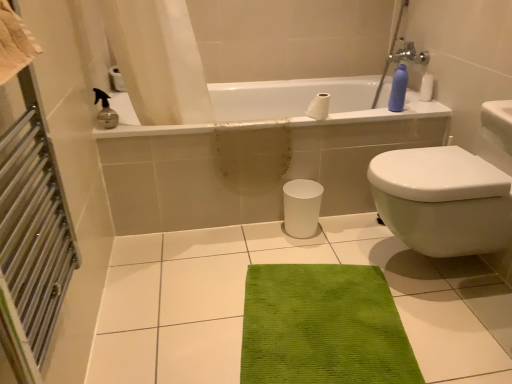
What do you see at coordinates (319, 107) in the screenshot? I see `white matte toilet paper at upper center` at bounding box center [319, 107].

This screenshot has height=384, width=512. In order to click on white matte toilet paper at upper center in this screenshot , I will do click(x=319, y=107).

What do you see at coordinates (259, 153) in the screenshot? Image resolution: width=512 pixels, height=384 pixels. I see `white glossy bathtub at upper center` at bounding box center [259, 153].

Describe the element at coordinates (301, 207) in the screenshot. This screenshot has width=512, height=384. I see `white glossy trash can at center` at that location.

Where is `white glossy bidet at right`? Image resolution: width=512 pixels, height=384 pixels. white glossy bidet at right is located at coordinates (442, 200).

Describe the element at coordinates (286, 263) in the screenshot. I see `white ceramic tile at center` at that location.

Find the location of `white matte toilet paper at upper center`. white matte toilet paper at upper center is located at coordinates (319, 107).

Is white glossy trash can at center outside of green textured mat at center?

Yes, white glossy trash can at center is located beyond the bounds of green textured mat at center.

Based on the photo, considering the relative positions of white glossy trash can at center and green textured mat at center in the image provided, is white glossy trash can at center behind green textured mat at center?

That is True.

Does white glossy trash can at center have a larger size compared to green textured mat at center?

Incorrect, white glossy trash can at center is not larger than green textured mat at center.

From the image's perspective, is matte blue plastic bottle at upper right above beige cotton towel at left?

Yes.

Which is in front, matte blue plastic bottle at upper right or beige cotton towel at left?

beige cotton towel at left is closer to the camera.

Would you say matte blue plastic bottle at upper right is a long distance from beige cotton towel at left?

Absolutely, matte blue plastic bottle at upper right is distant from beige cotton towel at left.

Is white matte toilet paper at upper center aimed at white glossy trash can at center?

No, white matte toilet paper at upper center is not turned towards white glossy trash can at center.

Considering the sizes of objects white matte toilet paper at upper center and white glossy trash can at center in the image provided, who is wider, white matte toilet paper at upper center or white glossy trash can at center?

white glossy trash can at center.

Considering the positions of objects white matte toilet paper at upper center and white glossy trash can at center in the image provided, who is behind, white matte toilet paper at upper center or white glossy trash can at center?

white glossy trash can at center is further away from the camera.

Is point (316, 114) positioned behind point (298, 206)?

No, it is not.

From a real-world perspective, is white glossy bidet at right below beige cotton towel at left?

Yes, from a real-world perspective, white glossy bidet at right is beneath beige cotton towel at left.

From the image's perspective, would you say white glossy bidet at right is shown under beige cotton towel at left?

Yes, from the image's perspective, white glossy bidet at right is below beige cotton towel at left.

Is white glossy bidet at right not near beige cotton towel at left?

white glossy bidet at right is far away from beige cotton towel at left.

Where is `beach towel above the white glossy bidet at right (from the image's perspective)`? The height and width of the screenshot is (384, 512). beach towel above the white glossy bidet at right (from the image's perspective) is located at coordinates (14, 43).

Between beige cotton towel at left and white glossy bidet at right, which one appears on the left side from the viewer's perspective?

Positioned to the left is beige cotton towel at left.

Can you confirm if beige cotton towel at left is thinner than white glossy bidet at right?

Correct, the width of beige cotton towel at left is less than that of white glossy bidet at right.

Does beige cotton towel at left touch white glossy bidet at right?

No, beige cotton towel at left is not making contact with white glossy bidet at right.

Is white glossy bathtub at upper center inside the boundaries of green textured mat at center, or outside?

white glossy bathtub at upper center cannot be found inside green textured mat at center.

Locate an element on the screen. This screenshot has width=512, height=384. bath behind the green textured mat at center is located at coordinates (259, 153).

Visually, is white glossy bathtub at upper center positioned to the left or to the right of green textured mat at center?

white glossy bathtub at upper center is positioned on green textured mat at center's left side.

From a real-world perspective, which object stands above the other?

From a 3D spatial view, white glossy bathtub at upper center is above.

From a real-world perspective, is white glossy trash can at center above or below white ceramic tile at center?

From a real-world perspective, white glossy trash can at center is physically above white ceramic tile at center.

Is white glossy trash can at center located outside white ceramic tile at center?

Yes.

Locate an element on the screen. ceramic tile below the white glossy trash can at center (from the image's perspective) is located at coordinates (286, 263).

Based on their positions, is white glossy trash can at center located to the left or right of white ceramic tile at center?

From the image, it's evident that white glossy trash can at center is to the right of white ceramic tile at center.

The width and height of the screenshot is (512, 384). I want to click on porcelain above the green textured mat at center (from a real-world perspective), so pyautogui.click(x=301, y=207).

What are the coordinates of `beach towel on the left of matte blue plastic bottle at upper right` in the screenshot? It's located at (14, 43).

Consider the image. When comparing their distances from white glossy trash can at center, does white ceramic tile at center or green textured mat at center seem closer?

Based on the image, white ceramic tile at center appears to be nearer to white glossy trash can at center.

From the image, which object appears to be farther from beige cotton towel at left, white matte toilet paper at upper center or white glossy bathtub at upper center?

white glossy bathtub at upper center is further to beige cotton towel at left.

Looking at the image, which one is located further to green textured mat at center, white matte toilet paper at upper center or matte blue plastic bottle at upper right?

The object further to green textured mat at center is matte blue plastic bottle at upper right.

From the image, which object appears to be farther from white ceramic tile at center, brushed metal radiator at left or white glossy trash can at center?

brushed metal radiator at left lies further to white ceramic tile at center than the other object.

Which object lies further to the anchor point white ceramic tile at center, white glossy bidet at right or white glossy bathtub at upper center?

Among the two, white glossy bathtub at upper center is located further to white ceramic tile at center.

Estimate the real-world distances between objects in this image. Which object is further from brushed metal radiator at left, white glossy bidet at right or white glossy bathtub at upper center?

white glossy bidet at right is further to brushed metal radiator at left.

In the scene shown: Estimate the real-world distances between objects in this image. Which object is closer to white ceramic tile at center, beige cotton towel at left or white glossy bidet at right?

white glossy bidet at right lies closer to white ceramic tile at center than the other object.

When comparing their distances from matte blue plastic bottle at upper right, does beige cotton towel at left or white matte toilet paper at upper center seem further?

Among the two, beige cotton towel at left is located further to matte blue plastic bottle at upper right.

The width and height of the screenshot is (512, 384). I want to click on beach towel between brushed metal radiator at left and white glossy bathtub at upper center in the front-back direction, so click(14, 43).

Locate an element on the screen. Image resolution: width=512 pixels, height=384 pixels. ceramic tile between brushed metal radiator at left and white matte toilet paper at upper center in the front-back direction is located at coordinates (286, 263).

Find the location of a particular element. beach towel between brushed metal radiator at left and white glossy trash can at center along the z-axis is located at coordinates tap(14, 43).

The height and width of the screenshot is (384, 512). I want to click on doormat between brushed metal radiator at left and white glossy bathtub at upper center from front to back, so (x=323, y=327).